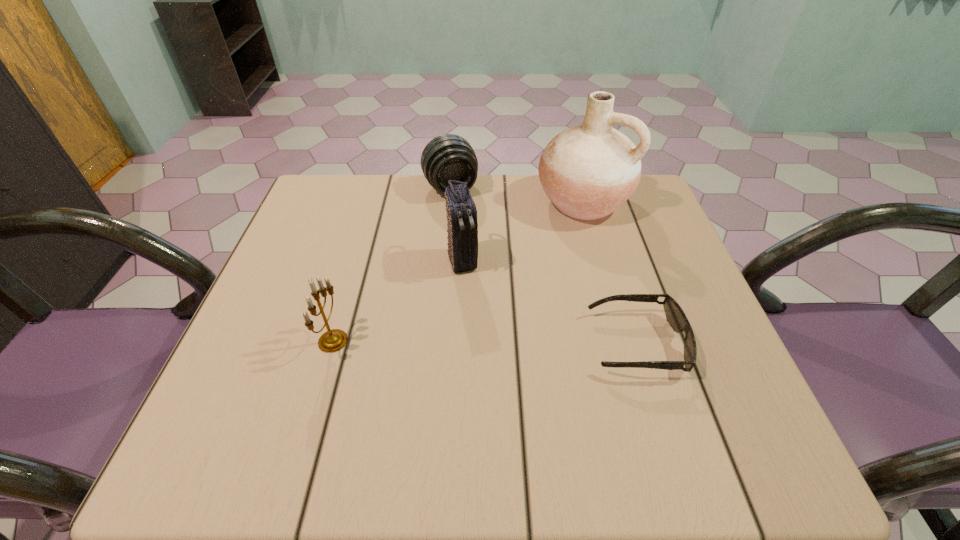
Image resolution: width=960 pixels, height=540 pixels. Find the location of `free spot that satisfies the following two spatial constraints: 1. on the back side of the clutch bag; 2. on the right side of the pottery`. free spot that satisfies the following two spatial constraints: 1. on the back side of the clutch bag; 2. on the right side of the pottery is located at coordinates (466, 201).

This screenshot has height=540, width=960. Identify the location of free space in the image that satisfies the following two spatial constraints: 1. on the front side of the shortest object; 2. on the front-facing side of the leftmost object. (332, 343).

Where is `vacant space that satisfies the following two spatial constraints: 1. on the back side of the leftmost object; 2. on the right side of the tallest object`? Image resolution: width=960 pixels, height=540 pixels. vacant space that satisfies the following two spatial constraints: 1. on the back side of the leftmost object; 2. on the right side of the tallest object is located at coordinates (373, 201).

Locate an element on the screen. This screenshot has width=960, height=540. vacant space that satisfies the following two spatial constraints: 1. on the front side of the telephoto lens; 2. on the left side of the clutch bag is located at coordinates (444, 260).

Locate an element on the screen. This screenshot has width=960, height=540. free space that satisfies the following two spatial constraints: 1. on the front side of the sunglasses; 2. on the front-facing side of the telephoto lens is located at coordinates (438, 343).

The height and width of the screenshot is (540, 960). Identify the location of vacant space that satisfies the following two spatial constraints: 1. on the front side of the sunglasses; 2. on the front-facing side of the clutch bag. (459, 343).